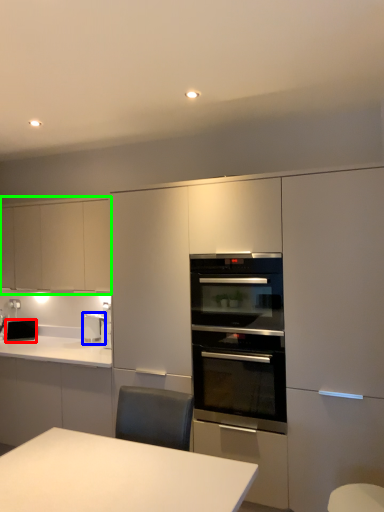
Question: Which object is positioned farthest from appliance (highlighted by a red box)? Select from home appliance (highlighted by a blue box) and cabinetry (highlighted by a green box).

Choices:
 (A) home appliance
 (B) cabinetry

Answer: (B)